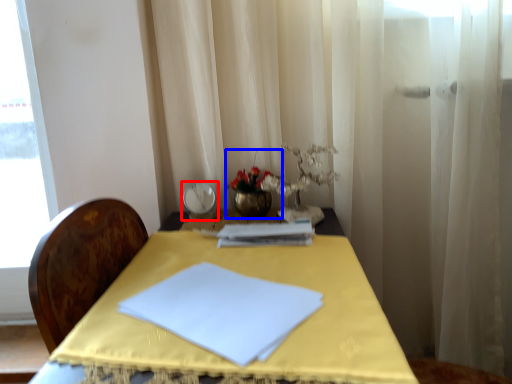
Question: Which object is closer to the camera taking this photo, tableware (highlighted by a red box) or floral arrangement (highlighted by a blue box)?

Choices:
 (A) tableware
 (B) floral arrangement

Answer: (B)